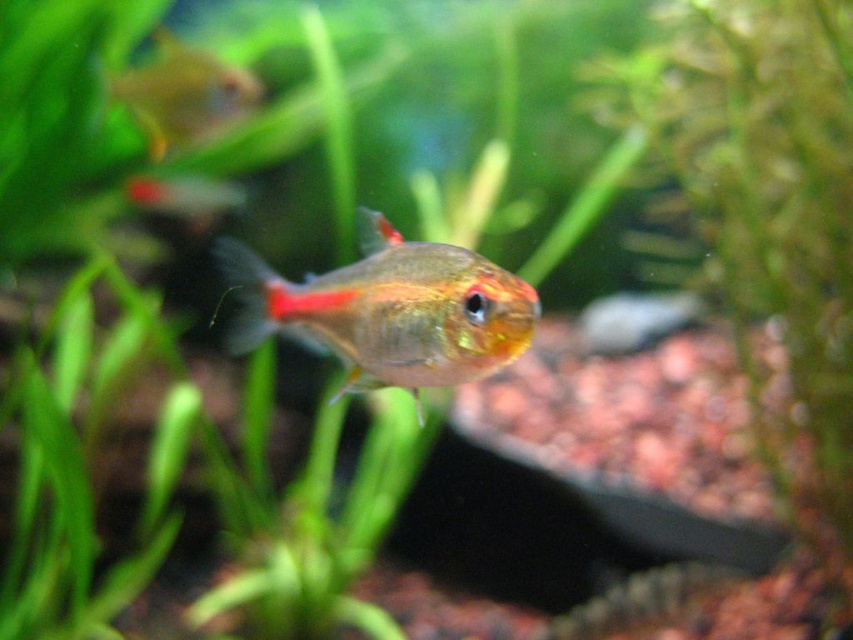
Does translucent glass fish at center have a greater width compared to translucent glass fish at upper left?

Correct, the width of translucent glass fish at center exceeds that of translucent glass fish at upper left.

Measure the distance between point [409,291] and camera.

The distance of point [409,291] from camera is 1.56 meters.

Locate an element on the screen. Image resolution: width=853 pixels, height=640 pixels. translucent glass fish at center is located at coordinates (389, 310).

You are a GUI agent. You are given a task and a screenshot of the screen. Output one action in this format:
    pyautogui.click(x=<x>, y=<y>)
    Task: Click on the translucent glass fish at center
    The width and height of the screenshot is (853, 640).
    Given the screenshot: What is the action you would take?
    pyautogui.click(x=389, y=310)